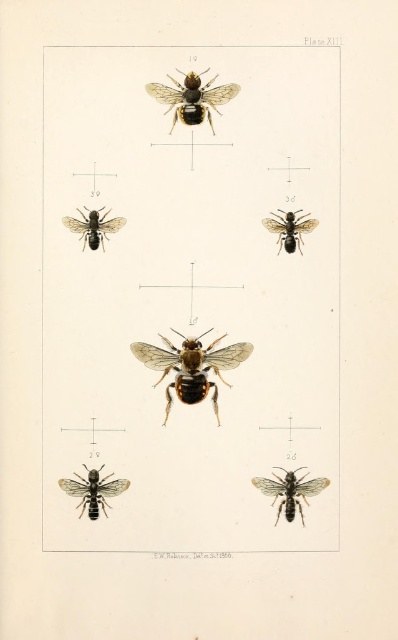
Which is in front, point (273, 225) or point (122, 220)?

Point (122, 220) is more forward.

Does point (277, 236) come in front of point (115, 225)?

That is False.

Where is `black matte wasp at upper right`? black matte wasp at upper right is located at coordinates (290, 228).

Which is behind, point (212, 131) or point (288, 513)?

Point (212, 131)

Is black matte bee at upper center shorter than black matte wasp at lower right?

No, black matte bee at upper center is not shorter than black matte wasp at lower right.

Between point (189, 113) and point (284, 477), which one is positioned in front?

Point (189, 113) is in front.

You are a GUI agent. You are given a task and a screenshot of the screen. Output one action in this format:
    pyautogui.click(x=<x>, y=<y>)
    Task: Click on the black matte bee at upper center
    This screenshot has height=640, width=398.
    Given the screenshot: What is the action you would take?
    pyautogui.click(x=191, y=99)

Does black matte bee at lower left have a lesser height compared to black matte wasp at upper right?

In fact, black matte bee at lower left may be taller than black matte wasp at upper right.

The width and height of the screenshot is (398, 640). Find the location of `black matte bee at lower left`. black matte bee at lower left is located at coordinates coord(93,490).

Which is behind, point (83, 484) or point (282, 230)?

Point (282, 230)

This screenshot has height=640, width=398. I want to click on black matte bee at lower left, so click(93, 490).